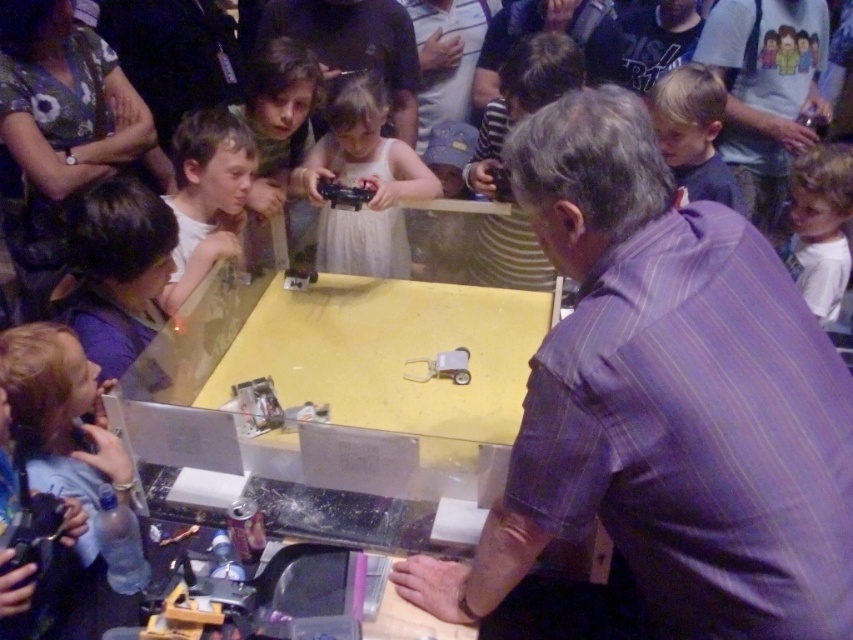
Question: Does dark brown hair at lower left appear on the left side of blonde hair boy at upper right?

Choices:
 (A) yes
 (B) no

Answer: (A)

Question: From the image, what is the correct spatial relationship of dark brown hair at lower left in relation to white matte shirt at left?

Choices:
 (A) right
 (B) left

Answer: (B)

Question: Which is nearer to the blonde hair boy at upper right?

Choices:
 (A) white matte shirt at left
 (B) white matte dress at center
 (C) blonde hair at left

Answer: (B)

Question: Which point is closer to the camera?

Choices:
 (A) (677, 68)
 (B) (59, 348)
 (C) (834, 528)

Answer: (C)

Question: From the image, what is the correct spatial relationship of purple striped shirt at center in relation to blonde hair boy at upper right?

Choices:
 (A) above
 (B) below

Answer: (B)

Question: Which of the following is the closest to the observer?

Choices:
 (A) white cotton shirt at upper right
 (B) blonde hair at left
 (C) blonde hair boy at upper right

Answer: (B)